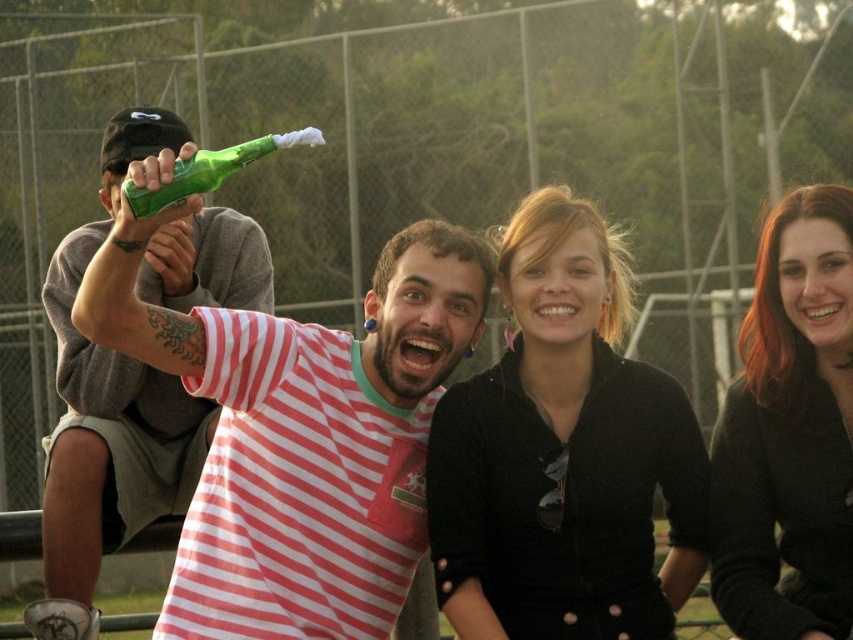
Is striped cotton shirt at center to the right of black matte jacket at center from the viewer's perspective?

Incorrect, striped cotton shirt at center is not on the right side of black matte jacket at center.

Describe the element at coordinates (302, 436) in the screenshot. I see `striped cotton shirt at center` at that location.

This screenshot has width=853, height=640. I want to click on striped cotton shirt at center, so click(x=302, y=436).

Does green matte bottle at left have a smaller size compared to green glass bottle at upper left?

Actually, green matte bottle at left might be larger than green glass bottle at upper left.

Can you confirm if green matte bottle at left is bigger than green glass bottle at upper left?

Yes.

Find the location of a particular element. green matte bottle at left is located at coordinates (105, 451).

Locate an element on the screen. This screenshot has width=853, height=640. green matte bottle at left is located at coordinates (105, 451).

Which is more to the left, striped cotton shirt at center or green glass bottle at upper left?

Positioned to the left is green glass bottle at upper left.

Can you confirm if striped cotton shirt at center is taller than green glass bottle at upper left?

Yes, striped cotton shirt at center is taller than green glass bottle at upper left.

Locate an element on the screen. striped cotton shirt at center is located at coordinates (302, 436).

Identify the location of striped cotton shirt at center. (302, 436).